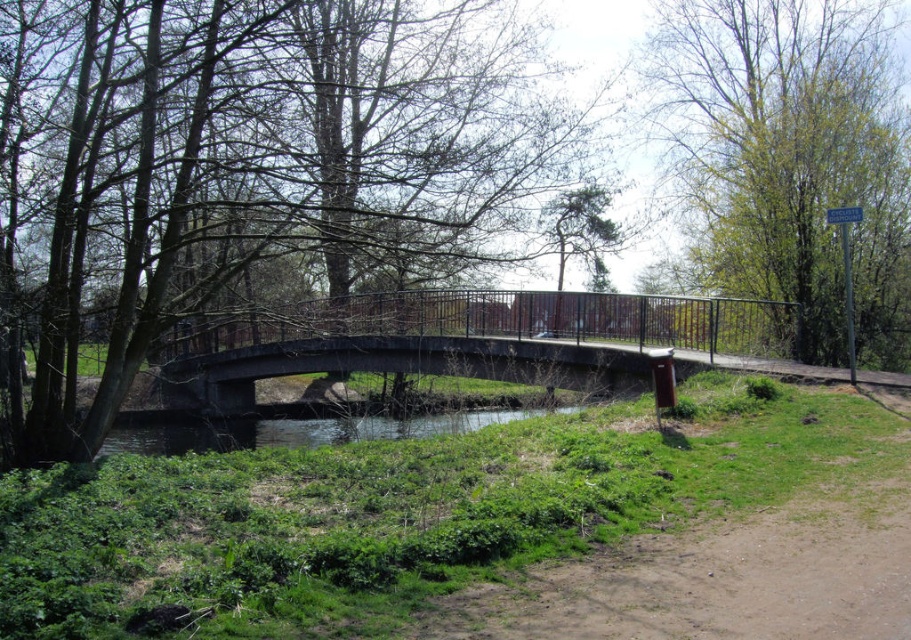
You are a bird flying over the serene outdoor scene. You want to land on a tree that is closer to you. Which tree should you choose between the brown wood tree at center and the green leafy tree at upper right?

The brown wood tree at center is closer to you because it is positioned in front of the green leafy tree at upper right, so you should choose the brown wood tree at center to land on.

You are a landscape architect designing a walking path that must pass between the brown wood tree at center and the concrete bridge at center. The path must be exactly 6 meters long. Is this possible?

The brown wood tree at center and concrete bridge at center are 6.10 meters apart. Since the required path length is 6 meters, which is shorter than the actual distance between them, the path cannot be exactly 6 meters long. It would need to be at least 6.10 meters to reach both points.